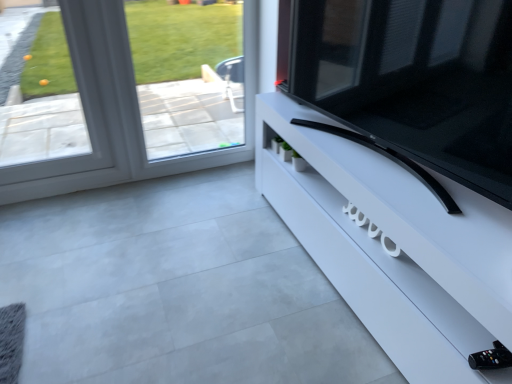
Locate an element on the screen. black glossy tv at right is located at coordinates (410, 79).

You are a GUI agent. You are given a task and a screenshot of the screen. Output one action in this format:
    pyautogui.click(x=<x>, y=<y>)
    Task: Click on the clear glass window at upper left
    The width and height of the screenshot is (512, 384).
    Given the screenshot: What is the action you would take?
    point(117,111)

Locate an element on the screen. The width and height of the screenshot is (512, 384). black glossy tv at right is located at coordinates (410, 79).

From a real-world perspective, between white glossy tv stand at right and clear glass window at upper left, who is vertically lower?

white glossy tv stand at right.

Consider the image. Between white glossy tv stand at right and clear glass window at upper left, which one has less height?

Standing shorter between the two is white glossy tv stand at right.

Looking at their sizes, would you say white glossy tv stand at right is wider or thinner than clear glass window at upper left?

white glossy tv stand at right is wider than clear glass window at upper left.

Which is more to the left, white glossy tv stand at right or clear glass window at upper left?

clear glass window at upper left is more to the left.

Is clear glass window at upper left thinner than white glossy tv stand at right?

Indeed, clear glass window at upper left has a lesser width compared to white glossy tv stand at right.

Would you say clear glass window at upper left is to the left or to the right of white glossy tv stand at right in the picture?

From the image, it's evident that clear glass window at upper left is to the left of white glossy tv stand at right.

Based on their sizes in the image, would you say clear glass window at upper left is bigger or smaller than white glossy tv stand at right?

Clearly, clear glass window at upper left is smaller in size than white glossy tv stand at right.

Can you confirm if white glossy tv stand at right is positioned to the left of black glossy tv at right?

No.

Is white glossy tv stand at right with black glossy tv at right?

white glossy tv stand at right and black glossy tv at right are clearly separated.

From a real-world perspective, is white glossy tv stand at right physically below black glossy tv at right?

Yes, from a real-world perspective, white glossy tv stand at right is below black glossy tv at right.

Considering the relative sizes of white glossy tv stand at right and black glossy tv at right in the image provided, is white glossy tv stand at right shorter than black glossy tv at right?

Yes.

Is black glossy tv at right not inside white glossy tv stand at right?

black glossy tv at right is positioned outside white glossy tv stand at right.

Is black glossy tv at right bigger or smaller than white glossy tv stand at right?

Considering their sizes, black glossy tv at right takes up less space than white glossy tv stand at right.

How different are the orientations of black glossy tv at right and white glossy tv stand at right in degrees?

The angular difference between black glossy tv at right and white glossy tv stand at right is 9.87 degrees.

In the scene shown: Is black glossy tv at right taller or shorter than white glossy tv stand at right?

In the image, black glossy tv at right appears to be taller than white glossy tv stand at right.

From a real-world perspective, is black glossy tv at right physically above clear glass window at upper left?

Yes, from a real-world perspective, black glossy tv at right is above clear glass window at upper left.

Considering the relative sizes of black glossy tv at right and clear glass window at upper left in the image provided, is black glossy tv at right bigger than clear glass window at upper left?

Indeed, black glossy tv at right has a larger size compared to clear glass window at upper left.

In the scene shown: Which object is further away from the camera taking this photo, black glossy tv at right or clear glass window at upper left?

clear glass window at upper left is further away from the camera.

Between point (487, 30) and point (106, 73), which one is positioned behind?

Point (106, 73)

Does clear glass window at upper left have a smaller size compared to black glossy tv at right?

Indeed, clear glass window at upper left has a smaller size compared to black glossy tv at right.

Considering the sizes of objects clear glass window at upper left and black glossy tv at right in the image provided, who is thinner, clear glass window at upper left or black glossy tv at right?

Thinner between the two is clear glass window at upper left.

Considering their positions, is clear glass window at upper left located in front of or behind black glossy tv at right?

Visually, clear glass window at upper left is located behind black glossy tv at right.

Locate an element on the screen. This screenshot has height=384, width=512. furniture in front of the clear glass window at upper left is located at coordinates (393, 245).

The height and width of the screenshot is (384, 512). Identify the location of window that appears above the white glossy tv stand at right (from a real-world perspective). (117, 111).

Considering their positions, is clear glass window at upper left positioned closer to white glossy tv stand at right than black glossy tv at right?

black glossy tv at right is positioned closer to the anchor white glossy tv stand at right.

From the image, which object appears to be nearer to black glossy tv at right, clear glass window at upper left or white glossy tv stand at right?

Among the two, white glossy tv stand at right is located nearer to black glossy tv at right.

Based on their spatial positions, is white glossy tv stand at right or black glossy tv at right further from clear glass window at upper left?

black glossy tv at right.

Estimate the real-world distances between objects in this image. Which object is closer to clear glass window at upper left, black glossy tv at right or white glossy tv stand at right?

white glossy tv stand at right lies closer to clear glass window at upper left than the other object.

Based on their spatial positions, is black glossy tv at right or clear glass window at upper left further from white glossy tv stand at right?

Among the two, clear glass window at upper left is located further to white glossy tv stand at right.

Looking at the image, which one is located further to black glossy tv at right, white glossy tv stand at right or clear glass window at upper left?

The object further to black glossy tv at right is clear glass window at upper left.

Find the location of `furniture between black glossy tv at right and clear glass window at upper left in the front-back direction`. furniture between black glossy tv at right and clear glass window at upper left in the front-back direction is located at coordinates (393, 245).